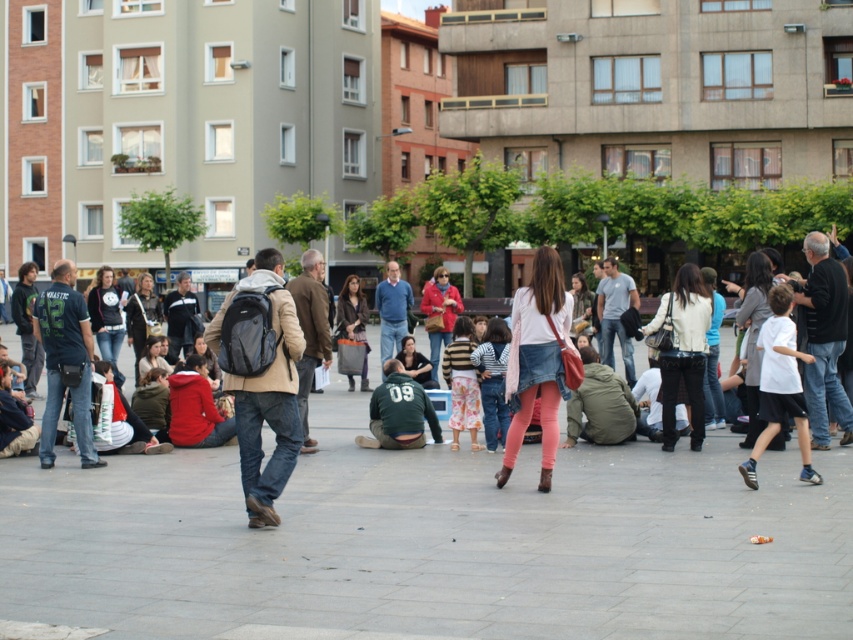
Is point (271, 460) positioned behind point (419, 428)?

No, it is not.

Where is `matte black backpack at center`? The height and width of the screenshot is (640, 853). matte black backpack at center is located at coordinates (270, 410).

Is denim skirt at center behind green matte jacket at center?

No, it is not.

Does denim skirt at center have a lesser height compared to green matte jacket at center?

In fact, denim skirt at center may be taller than green matte jacket at center.

Which is in front, point (537, 292) or point (405, 419)?

Point (537, 292) is in front.

This screenshot has height=640, width=853. Identify the location of denim skirt at center. pyautogui.click(x=537, y=362).

Is point (775, 385) less distant than point (403, 289)?

That is True.

Is point (781, 305) positioned behind point (412, 296)?

No, it is in front of (412, 296).

The width and height of the screenshot is (853, 640). In order to click on white cotton shirt at right in this screenshot , I will do `click(780, 385)`.